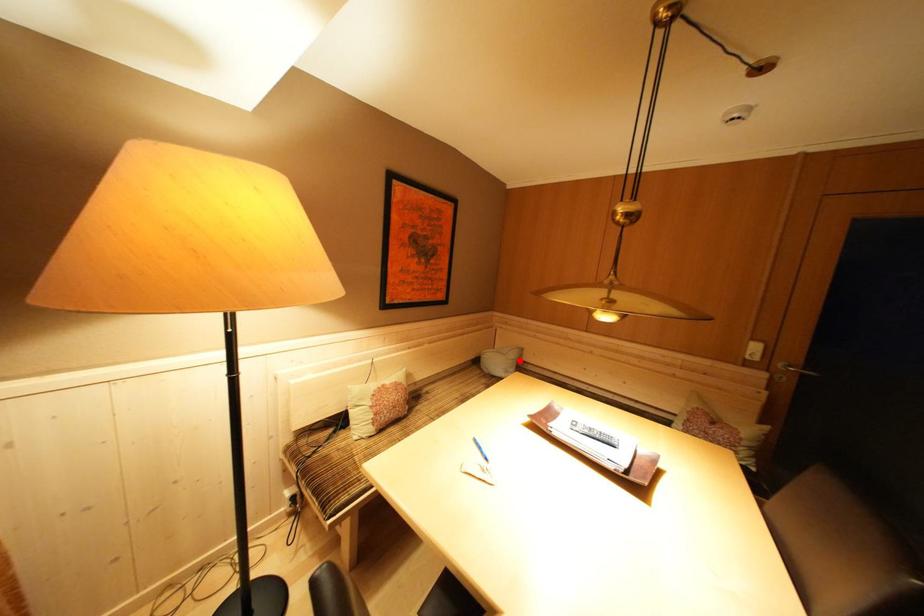
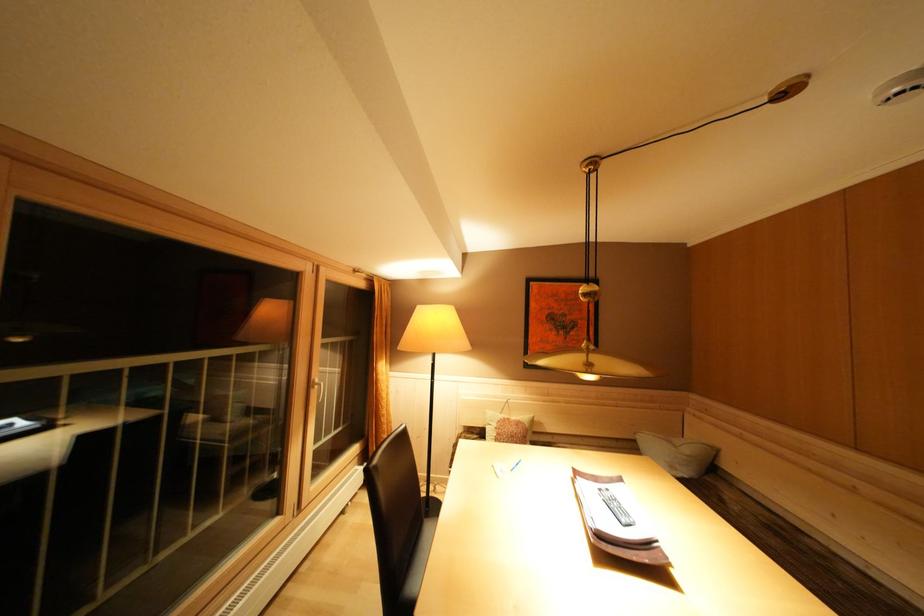
Find the pixel in the second image that matches the highlighted location in the first image.

(695, 456)